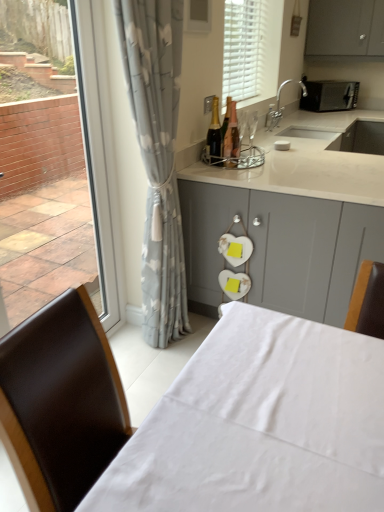
Image resolution: width=384 pixels, height=512 pixels. Describe the element at coordinates (251, 49) in the screenshot. I see `white matte blinds at upper center` at that location.

Measure the distance between white matte blinds at upper center and camera.

white matte blinds at upper center is 9.01 feet from camera.

What do you see at coordinates (281, 247) in the screenshot? This screenshot has height=512, width=384. I see `matte gray cabinets at center` at bounding box center [281, 247].

What is the approximate width of white fabric table at lower center?

white fabric table at lower center is 23.03 inches wide.

Locate an element on the screen. The width and height of the screenshot is (384, 512). shiny gold bottle at center, the 2th bottle when ordered from left to right is located at coordinates (231, 139).

Is shiny gold bottle at center, the 2th bottle when ordered from left to right, taller than silver metallic faucet at upper right?

Indeed, shiny gold bottle at center, the 2th bottle when ordered from left to right, has a greater height compared to silver metallic faucet at upper right.

Does shiny gold bottle at center, the 2th bottle when ordered from left to right, turn towards silver metallic faucet at upper right?

No, shiny gold bottle at center, the 2th bottle when ordered from left to right, is not aimed at silver metallic faucet at upper right.

What's the angular difference between shiny gold bottle at center, the 2th bottle when ordered from left to right, and silver metallic faucet at upper right's facing directions?

1.08 degrees.

Which is in front, point (228, 161) or point (269, 108)?

The point (228, 161) is in front.

In the scene shown: From the image's perspective, is gray floral curtain at left above matte gray cabinets at center?

Yes, from the image's perspective, gray floral curtain at left is on top of matte gray cabinets at center.

From a real-world perspective, is gray floral curtain at left positioned over matte gray cabinets at center based on gravity?

Yes, from a real-world perspective, gray floral curtain at left is on top of matte gray cabinets at center.

Considering the relative sizes of gray floral curtain at left and matte gray cabinets at center in the image provided, is gray floral curtain at left bigger than matte gray cabinets at center?

Actually, gray floral curtain at left might be smaller than matte gray cabinets at center.

Can you confirm if gray floral curtain at left is shorter than matte gray cabinets at center?

No, gray floral curtain at left is not shorter than matte gray cabinets at center.

Which of these two, white matte blinds at upper center or matte gray cabinets at center, is wider?

matte gray cabinets at center is wider.

Is matte gray cabinets at center completely or partially inside white matte blinds at upper center?

No, matte gray cabinets at center is located outside of white matte blinds at upper center.

Based on the photo, from a real-world perspective, which is physically above, white matte blinds at upper center or matte gray cabinets at center?

In real-world perspective, white matte blinds at upper center is above.

Is white matte blinds at upper center next to matte gray cabinets at center and touching it?

No, white matte blinds at upper center is not beside matte gray cabinets at center.

In the scene shown: Does matte gray cabinets at center lie behind white matte blinds at upper center?

No, the depth of matte gray cabinets at center is less than that of white matte blinds at upper center.

Is there a large distance between matte gray cabinets at center and white matte blinds at upper center?

Yes, matte gray cabinets at center and white matte blinds at upper center are quite far apart.

In the scene shown: How distant is matte gray cabinets at center from white matte blinds at upper center?

1.52 meters.

This screenshot has height=512, width=384. Find the location of `bay window above the matte gray cabinets at center (from a real-world perspective)`. bay window above the matte gray cabinets at center (from a real-world perspective) is located at coordinates (251, 49).

Relative to black matte microwave at upper right, is shiny gold bottle at center, the 2th bottle when ordered from left to right, in front or behind?

shiny gold bottle at center, the 2th bottle when ordered from left to right, is in front of black matte microwave at upper right.

From the black matte microwave at upper right, count the 1st bottle to the left and point to it. Please provide its 2D coordinates.

[(231, 139)]

From their relative heights in the image, would you say shiny gold bottle at center, the 2th bottle when ordered from left to right, is taller or shorter than black matte microwave at upper right?

Considering their sizes, shiny gold bottle at center, the 2th bottle when ordered from left to right, has more height than black matte microwave at upper right.

From a real-world perspective, is shiny gold bottle at center, marked as the 1th bottle in a right-to-left arrangement, positioned over white fabric table at lower center based on gravity?

Indeed, from a real-world perspective, shiny gold bottle at center, marked as the 1th bottle in a right-to-left arrangement, stands above white fabric table at lower center.

Considering the positions of objects shiny gold bottle at center, marked as the 1th bottle in a right-to-left arrangement, and white fabric table at lower center in the image provided, who is more to the right, shiny gold bottle at center, marked as the 1th bottle in a right-to-left arrangement, or white fabric table at lower center?

shiny gold bottle at center, marked as the 1th bottle in a right-to-left arrangement, is more to the right.

From the image's perspective, which is above, shiny gold bottle at center, the 2th bottle when ordered from left to right, or white fabric table at lower center?

From the image's view, shiny gold bottle at center, the 2th bottle when ordered from left to right, is above.

How many degrees apart are the facing directions of shiny gold bottle at center, the 2th bottle when ordered from left to right, and white fabric table at lower center?

They differ by 2.88 degrees in their facing directions.

Between gray floral curtain at left and white fabric table at lower center, which one has smaller width?

With smaller width is gray floral curtain at left.

Considering the relative sizes of gray floral curtain at left and white fabric table at lower center in the image provided, is gray floral curtain at left smaller than white fabric table at lower center?

Indeed, gray floral curtain at left has a smaller size compared to white fabric table at lower center.

Is gray floral curtain at left to the left or to the right of white fabric table at lower center in the image?

Clearly, gray floral curtain at left is on the left of white fabric table at lower center in the image.

Does gray floral curtain at left lie in front of white fabric table at lower center?

No, gray floral curtain at left is further to the viewer.

At what (x,y) coordinates should I click in order to perform the action: click on tap lying above the shiny gold bottle at center, the 2th bottle when ordered from left to right (from the image's perspective). Please return your answer as a coordinate pair (x, y). Looking at the image, I should click on (281, 106).

In order to click on cabinetry lying behind the gray floral curtain at left in this screenshot , I will do `click(281, 247)`.

Estimate the real-world distances between objects in this image. Which object is closer to transparent glass window at left, gray floral curtain at left or black matte microwave at upper right?

gray floral curtain at left is closer to transparent glass window at left.

Estimate the real-world distances between objects in this image. Which object is closer to shiny gold bottle at center, the 2th bottle when ordered from left to right, black matte microwave at upper right or white fabric table at lower center?

Based on the image, white fabric table at lower center appears to be nearer to shiny gold bottle at center, the 2th bottle when ordered from left to right.

Consider the image. Considering their positions, is black matte microwave at upper right positioned further to white matte blinds at upper center than transparent glass window at left?

Based on the image, transparent glass window at left appears to be further to white matte blinds at upper center.

Looking at the image, which one is located further to shiny gold bottle at center, marked as the 1th bottle in a right-to-left arrangement, matte gray cabinets at center or silver metallic faucet at upper right?

Among the two, silver metallic faucet at upper right is located further to shiny gold bottle at center, marked as the 1th bottle in a right-to-left arrangement.

Estimate the real-world distances between objects in this image. Which object is further from white fabric table at lower center, black matte microwave at upper right or shiny gold champagne bottle at center, which ranks as the second bottle in right-to-left order?

The object further to white fabric table at lower center is black matte microwave at upper right.

Looking at the image, which one is located further to black matte microwave at upper right, white fabric table at lower center or gray floral curtain at left?

white fabric table at lower center.

From the image, which object appears to be farther from gray floral curtain at left, white fabric table at lower center or white matte blinds at upper center?

white matte blinds at upper center.

Looking at the image, which one is located closer to white fabric table at lower center, gray floral curtain at left or shiny gold champagne bottle at center, placed as the 1th bottle when sorted from left to right?

gray floral curtain at left lies closer to white fabric table at lower center than the other object.

This screenshot has height=512, width=384. I want to click on bottle positioned between gray floral curtain at left and shiny gold bottle at center, the 2th bottle when ordered from left to right, from near to far, so click(214, 135).

The height and width of the screenshot is (512, 384). I want to click on curtain between transparent glass window at left and white matte blinds at upper center from front to back, so click(x=157, y=156).

Find the location of a particular element. Image resolution: width=384 pixels, height=512 pixels. tap between white matte blinds at upper center and shiny gold bottle at center, the 2th bottle when ordered from left to right, from top to bottom is located at coordinates (281, 106).

The width and height of the screenshot is (384, 512). What are the coordinates of `tap located between shiny gold bottle at center, the 2th bottle when ordered from left to right, and black matte microwave at upper right in the depth direction` in the screenshot? It's located at (281, 106).